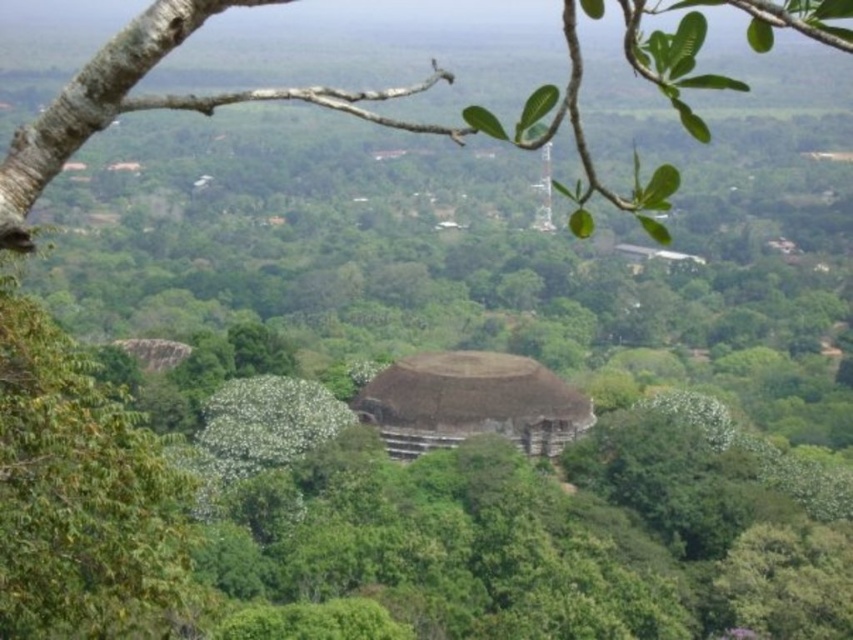
Question: Considering the relative positions of green leafy branch at upper center and brown thatch hut at center in the image provided, where is green leafy branch at upper center located with respect to brown thatch hut at center?

Choices:
 (A) below
 (B) above

Answer: (B)

Question: Which of the following is the farthest from the observer?

Choices:
 (A) green leafy branch at upper center
 (B) brown thatch hut at center

Answer: (B)

Question: Among these objects, which one is nearest to the camera?

Choices:
 (A) green leafy branch at upper center
 (B) brown thatch hut at center

Answer: (A)

Question: Can you confirm if green leafy branch at upper center is bigger than brown thatch hut at center?

Choices:
 (A) no
 (B) yes

Answer: (B)

Question: In this image, where is green leafy branch at upper center located relative to brown thatch hut at center?

Choices:
 (A) right
 (B) left

Answer: (B)